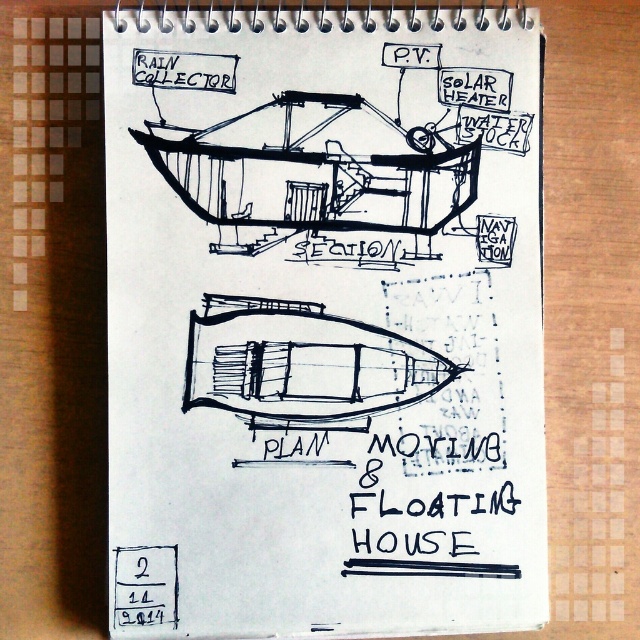
Question: Which object is the closest to the black line drawing boat at center?

Choices:
 (A) black matte boat at center
 (B) black ink text at lower center
 (C) black ink drawing at center

Answer: (C)

Question: Can you confirm if black line drawing boat at center is smaller than black matte boat at center?

Choices:
 (A) no
 (B) yes

Answer: (A)

Question: Which of the following is the closest to the observer?

Choices:
 (A) black ink drawing at center
 (B) black matte boat at center
 (C) black line drawing boat at center

Answer: (A)

Question: Does black line drawing boat at center appear under black matte boat at center?

Choices:
 (A) no
 (B) yes

Answer: (A)

Question: Is the position of black ink drawing at center less distant than that of black matte boat at center?

Choices:
 (A) yes
 (B) no

Answer: (A)

Question: Estimate the real-world distances between objects in this image. Which object is farther from the black matte boat at center?

Choices:
 (A) black ink text at lower center
 (B) black ink drawing at center
 (C) black line drawing boat at center

Answer: (C)